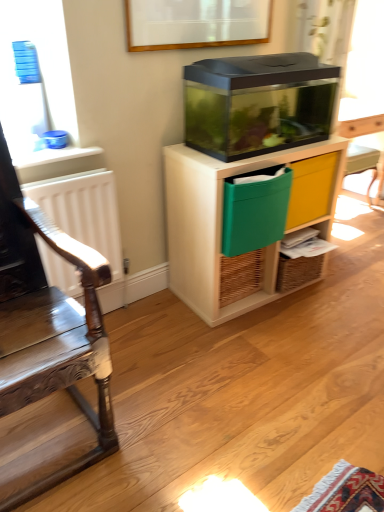
At what (x,y) coordinates should I click in order to perform the action: click on free space in front of transparent plastic cabinet at center. Please return your answer as a coordinate pair (x, y). Looking at the image, I should click on (266, 350).